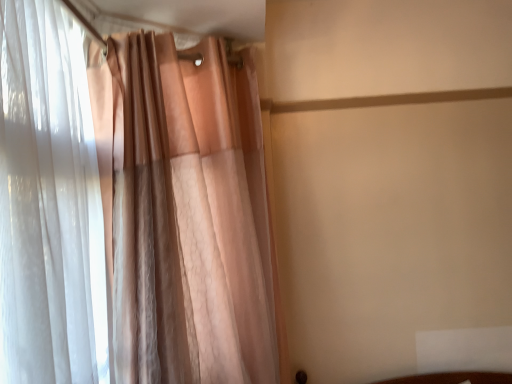
Question: Would you say translucent white curtain at left, the second curtain positioned from the right, is to the left or to the right of translucent pink curtain at left, which is counted as the 1th curtain, starting from the right, in the picture?

Choices:
 (A) left
 (B) right

Answer: (A)

Question: Is translucent white curtain at left, which appears as the 1th curtain when viewed from the left, taller or shorter than translucent pink curtain at left, which is counted as the 1th curtain, starting from the right?

Choices:
 (A) tall
 (B) short

Answer: (B)

Question: From a real-world perspective, relative to translucent pink curtain at left, which is counted as the second curtain, starting from the left, is translucent white curtain at left, which appears as the 1th curtain when viewed from the left, vertically above or below?

Choices:
 (A) below
 (B) above

Answer: (B)

Question: In the image, is translucent pink curtain at left, which is counted as the 1th curtain, starting from the right, positioned in front of or behind translucent white curtain at left, the second curtain positioned from the right?

Choices:
 (A) front
 (B) behind

Answer: (B)

Question: From the image's perspective, is translucent pink curtain at left, which is counted as the second curtain, starting from the left, positioned above or below translucent white curtain at left, which appears as the 1th curtain when viewed from the left?

Choices:
 (A) above
 (B) below

Answer: (B)

Question: From a real-world perspective, is translucent pink curtain at left, which is counted as the 1th curtain, starting from the right, positioned above or below translucent white curtain at left, which appears as the 1th curtain when viewed from the left?

Choices:
 (A) below
 (B) above

Answer: (A)

Question: Visually, is translucent pink curtain at left, which is counted as the second curtain, starting from the left, positioned to the left or to the right of translucent white curtain at left, the second curtain positioned from the right?

Choices:
 (A) right
 (B) left

Answer: (A)